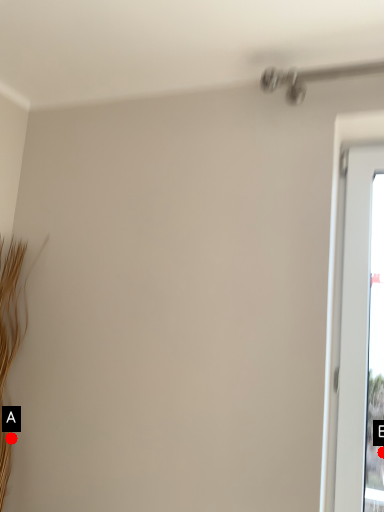
Question: Two points are circled on the image, labeled by A and B beside each circle. Among these points, which one is farthest from the camera?

Choices:
 (A) A is further
 (B) B is further

Answer: (B)